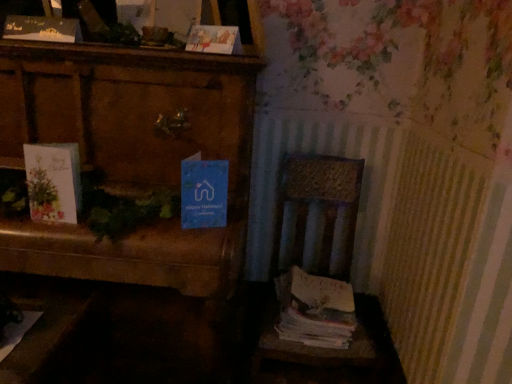
Question: From a real-world perspective, is wooden chair at lower right on top of blue paper at center, which appears as the second paperback book when viewed from the right?

Choices:
 (A) yes
 (B) no

Answer: (B)

Question: From the image's perspective, is wooden chair at lower right above blue paper at center, the 2th paperback book in the left-to-right sequence?

Choices:
 (A) yes
 (B) no

Answer: (B)

Question: Considering the relative sizes of wooden chair at lower right and blue paper at center, the first paperback book ordered from the bottom, in the image provided, is wooden chair at lower right wider than blue paper at center, the first paperback book ordered from the bottom,?

Choices:
 (A) no
 (B) yes

Answer: (B)

Question: Is wooden chair at lower right further to camera compared to blue paper at center, the third paperback book viewed from the top?

Choices:
 (A) no
 (B) yes

Answer: (B)

Question: Is wooden chair at lower right oriented towards blue paper at center, the 2th paperback book in the left-to-right sequence?

Choices:
 (A) yes
 (B) no

Answer: (B)

Question: Is wooden chair at lower right facing away from blue paper at center, which appears as the second paperback book when viewed from the right?

Choices:
 (A) no
 (B) yes

Answer: (A)

Question: Can you confirm if matte paper greeting card at left is shorter than matte paper card at upper center, the first paperback book viewed from the right?

Choices:
 (A) yes
 (B) no

Answer: (B)

Question: Is matte paper greeting card at left facing away from matte paper card at upper center, which appears as the 2th paperback book when viewed from the top?

Choices:
 (A) yes
 (B) no

Answer: (B)

Question: Does matte paper greeting card at left appear on the left side of matte paper card at upper center, which is the 2th paperback book in bottom-to-top order?

Choices:
 (A) no
 (B) yes

Answer: (B)

Question: Does matte paper greeting card at left have a larger size compared to matte paper card at upper center, the first paperback book viewed from the right?

Choices:
 (A) no
 (B) yes

Answer: (B)

Question: Is matte paper greeting card at left completely or partially outside of matte paper card at upper center, positioned as the 3th paperback book in left-to-right order?

Choices:
 (A) yes
 (B) no

Answer: (A)

Question: Does matte paper greeting card at left come in front of matte paper card at upper center, which is the 2th paperback book in bottom-to-top order?

Choices:
 (A) yes
 (B) no

Answer: (A)

Question: Considering the relative sizes of white paper stack at right and matte paper card at upper center, which is the 2th paperback book in bottom-to-top order, in the image provided, is white paper stack at right taller than matte paper card at upper center, which is the 2th paperback book in bottom-to-top order,?

Choices:
 (A) yes
 (B) no

Answer: (A)